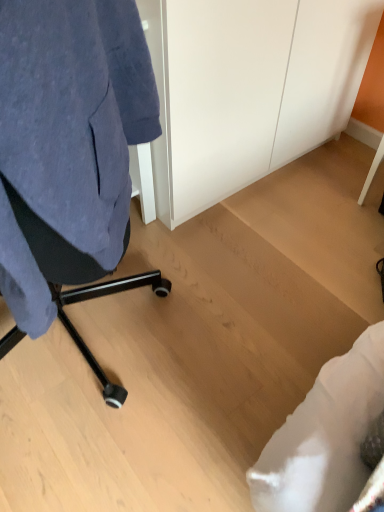
This screenshot has height=512, width=384. In order to click on velvet blue chair at left in this screenshot , I will do `click(77, 145)`.

What do you see at coordinates (77, 145) in the screenshot? I see `velvet blue chair at left` at bounding box center [77, 145].

What is the approximate height of velvet blue chair at left?

velvet blue chair at left is 64.99 centimeters tall.

This screenshot has height=512, width=384. Find the location of `velvet blue chair at left`. velvet blue chair at left is located at coordinates (77, 145).